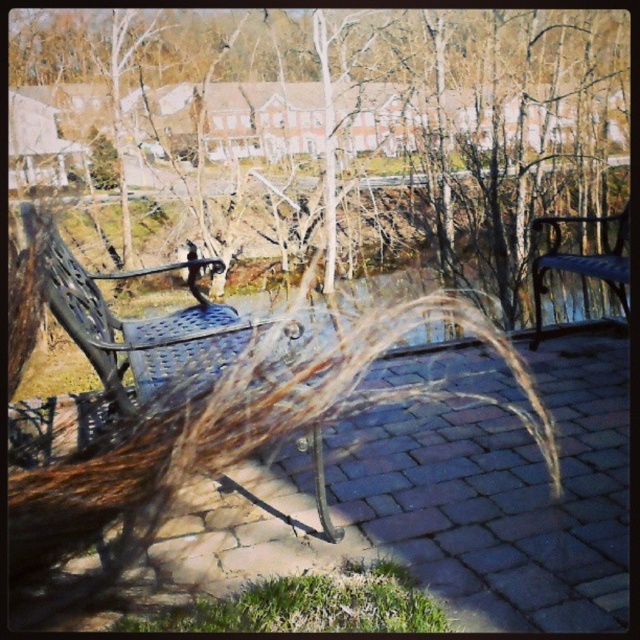
Is brown textured grass at center taller than metallic blue bench at right?

Yes, brown textured grass at center is taller than metallic blue bench at right.

Is point (161, 138) positioned before point (616, 248)?

No, it is not.

Image resolution: width=640 pixels, height=640 pixels. What are the coordinates of `brown textured grass at center` in the screenshot? It's located at (337, 129).

The height and width of the screenshot is (640, 640). Describe the element at coordinates (337, 129) in the screenshot. I see `brown textured grass at center` at that location.

Is point (355, 218) positioned behind point (97, 280)?

That is True.

Does point (134, 52) lie in front of point (154, 369)?

No, it is behind (154, 369).

This screenshot has width=640, height=640. Find the location of `brown textured grass at center`. brown textured grass at center is located at coordinates (337, 129).

Is metallic blue bench at center closer to camera compared to metallic blue bench at right?

Yes, metallic blue bench at center is in front of metallic blue bench at right.

Does metallic blue bench at center have a greater height compared to metallic blue bench at right?

Yes, metallic blue bench at center is taller than metallic blue bench at right.

Find the location of a particular element. metallic blue bench at center is located at coordinates (134, 321).

I want to click on metallic blue bench at center, so click(x=134, y=321).